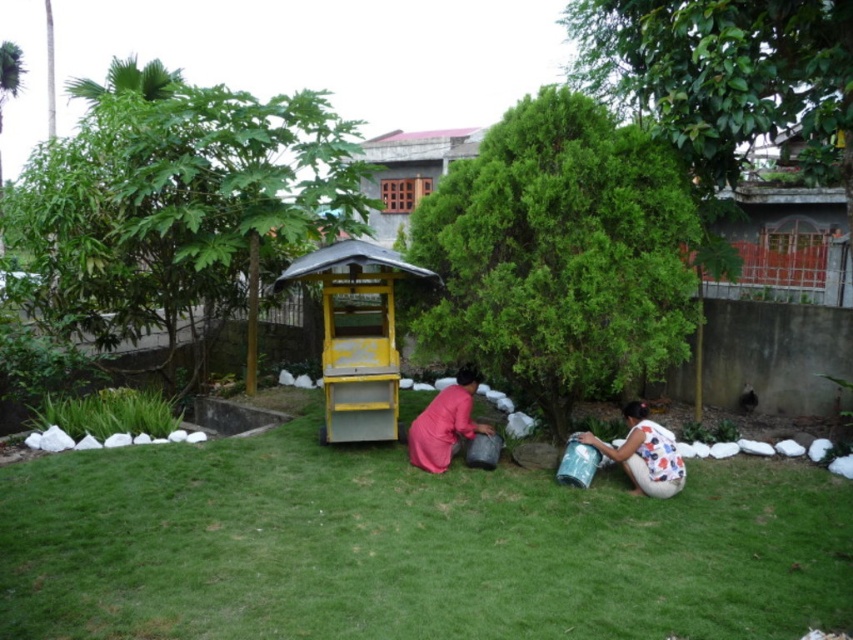
Question: Does green grass at center appear on the left side of pink matte fabric at center?

Choices:
 (A) yes
 (B) no

Answer: (B)

Question: Can you confirm if green grass at center is positioned above white floral dress at lower right?

Choices:
 (A) no
 (B) yes

Answer: (A)

Question: Estimate the real-world distances between objects in this image. Which object is farther from the yellow matte bus stop at center?

Choices:
 (A) green leafy tree at center
 (B) green leafy tree at upper left
 (C) white floral dress at lower right
 (D) green grass at center

Answer: (C)

Question: Which object is the farthest from the pink matte fabric at center?

Choices:
 (A) green leafy tree at center
 (B) green leafy tree at upper left
 (C) green grass at center
 (D) yellow matte bus stop at center

Answer: (B)

Question: Which of the following is the farthest from the observer?

Choices:
 (A) (679, 481)
 (B) (433, 444)

Answer: (B)

Question: Is green leafy tree at center to the right of white floral dress at lower right from the viewer's perspective?

Choices:
 (A) no
 (B) yes

Answer: (A)